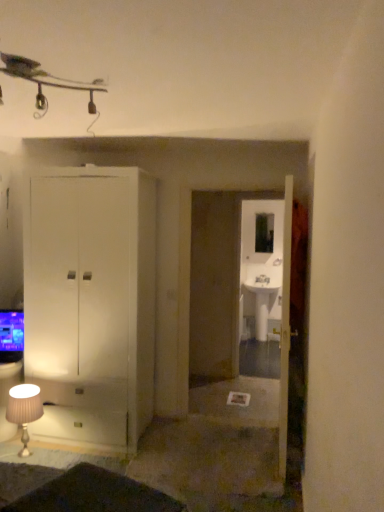
The image size is (384, 512). Find the location of `vacant space underneath transparent glass sink at center (from a real-world perspective)`. vacant space underneath transparent glass sink at center (from a real-world perspective) is located at coordinates (261, 379).